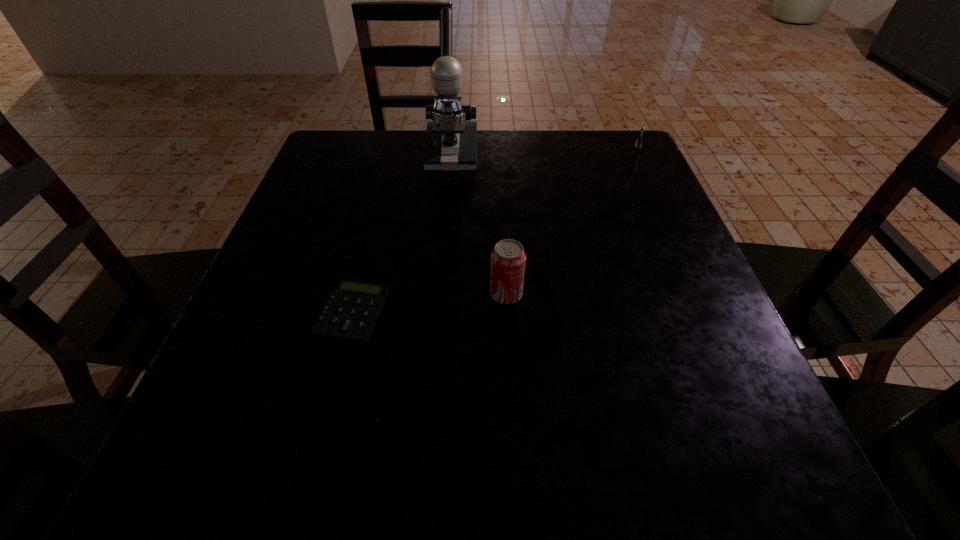
Find the location of `free space located 0.220m on the logo side of the third object from left to right`. free space located 0.220m on the logo side of the third object from left to right is located at coordinates (363, 295).

Image resolution: width=960 pixels, height=540 pixels. In order to click on free space located 0.190m on the logo side of the third object from left to right in this screenshot , I will do `click(380, 295)`.

Image resolution: width=960 pixels, height=540 pixels. Find the location of `vacant region located 0.400m on the front of the padlock`. vacant region located 0.400m on the front of the padlock is located at coordinates (692, 285).

Locate an element on the screen. This screenshot has width=960, height=540. blank space located on the back of the calculator is located at coordinates (372, 235).

Locate an element on the screen. The height and width of the screenshot is (540, 960). microscope that is positioned at the far edge is located at coordinates (450, 144).

Where is `padlock that is at the far edge`? padlock that is at the far edge is located at coordinates pyautogui.click(x=637, y=148).

At what (x,y) coordinates should I click in order to perform the action: click on object that is at the left edge. Please return your answer as a coordinate pair (x, y). The height and width of the screenshot is (540, 960). Looking at the image, I should click on (352, 310).

At what (x,y) coordinates should I click in order to perform the action: click on object that is at the right edge. Please return your answer as a coordinate pair (x, y). Looking at the image, I should click on (637, 148).

At what (x,y) coordinates should I click in order to perform the action: click on object present at the far right corner. Please return your answer as a coordinate pair (x, y). Looking at the image, I should click on (637, 148).

Identify the location of free space at the far edge of the desktop. The height and width of the screenshot is (540, 960). (526, 178).